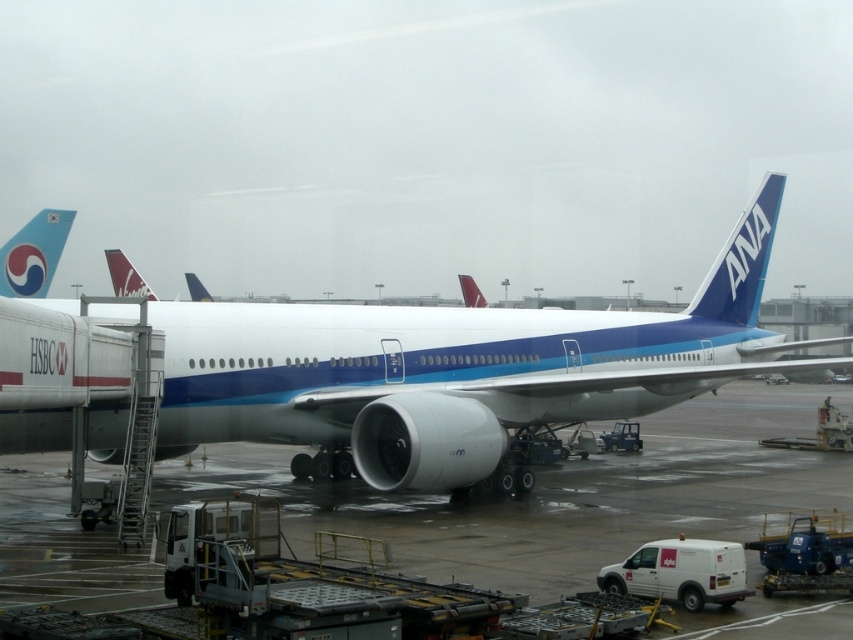
You are a photographer standing at the camera position. You want to take a photo of both point (18, 596) and point (741, 268). Which point will appear larger in your photo?

Point (18, 596) is closer to the camera than point (741, 268), so it will appear larger in the photo.

You are an airport staff member who needs to park a new vehicle that is 10 meters long. You see the white glossy airplane at center and the blue glossy tail fin at upper right. Which object has enough space to accommodate the vehicle without overlapping?

The white glossy airplane at center has a width larger than the blue glossy tail fin at upper right. Since the airplane is wider, it likely has more space around it to accommodate the 10 meter vehicle without overlapping.

You are a ground crew member who needs to position a new service vehicle at a specific coordinate. The white glossy airplane at center is currently at point A. Where should you place the new vehicle to ensure it is directly behind the airplane?

The white glossy airplane at center is located at point A, so you should place the new vehicle at a coordinate behind point A to ensure it is directly behind the airplane.